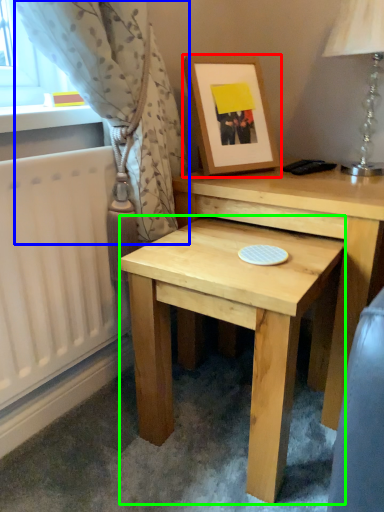
Question: Based on their relative distances, which object is farther from picture frame (highlighted by a red box)? Choose from curtain (highlighted by a blue box) and table (highlighted by a green box).

Choices:
 (A) curtain
 (B) table

Answer: (B)